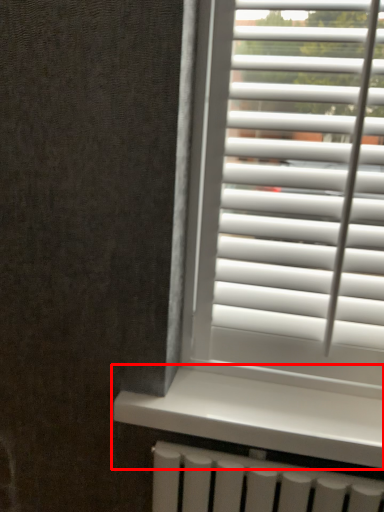
Question: From the image's perspective, where is window sill (annotated by the red box) located relative to blind?

Choices:
 (A) below
 (B) above

Answer: (A)